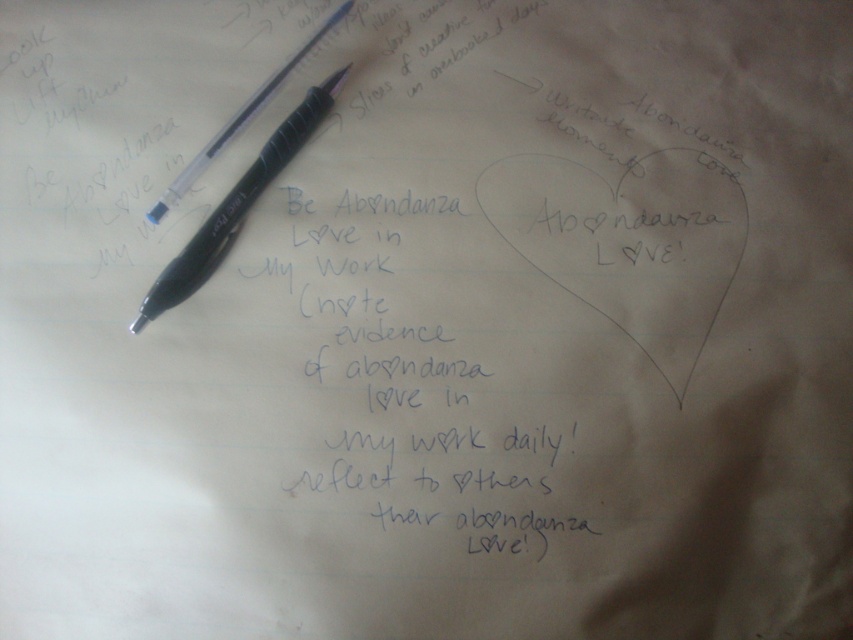
Question: Which object appears closest to the camera in this image?

Choices:
 (A) black plastic pen at upper left
 (B) matte black pen at upper left

Answer: (A)

Question: Can you confirm if black plastic pen at upper left is wider than matte black pen at upper left?

Choices:
 (A) yes
 (B) no

Answer: (A)

Question: Is black plastic pen at upper left below matte black pen at upper left?

Choices:
 (A) yes
 (B) no

Answer: (A)

Question: Does black plastic pen at upper left have a lesser width compared to matte black pen at upper left?

Choices:
 (A) no
 (B) yes

Answer: (A)

Question: Which object appears farthest from the camera in this image?

Choices:
 (A) matte black pen at upper left
 (B) black plastic pen at upper left

Answer: (A)

Question: Which point is closer to the camera taking this photo?

Choices:
 (A) (277, 81)
 (B) (344, 76)

Answer: (A)